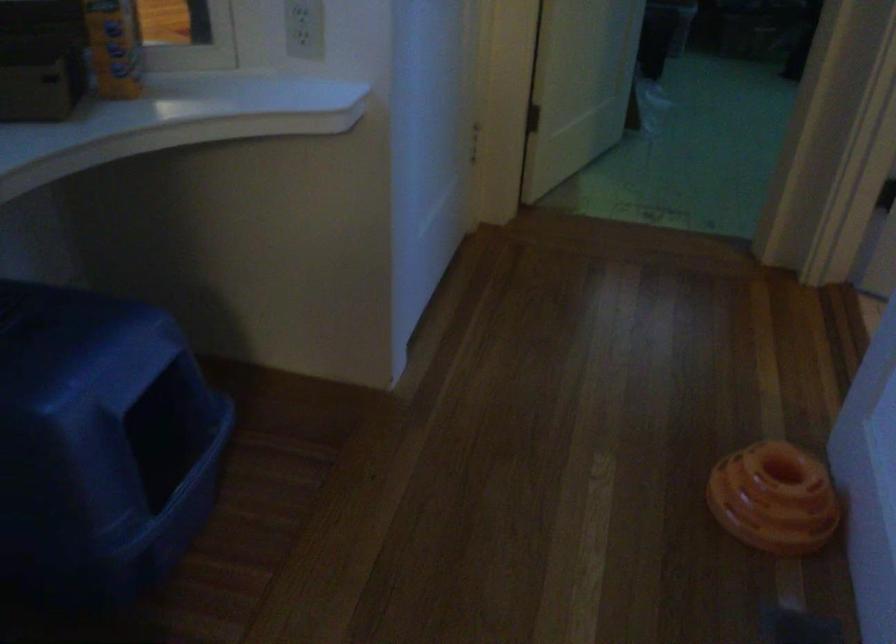
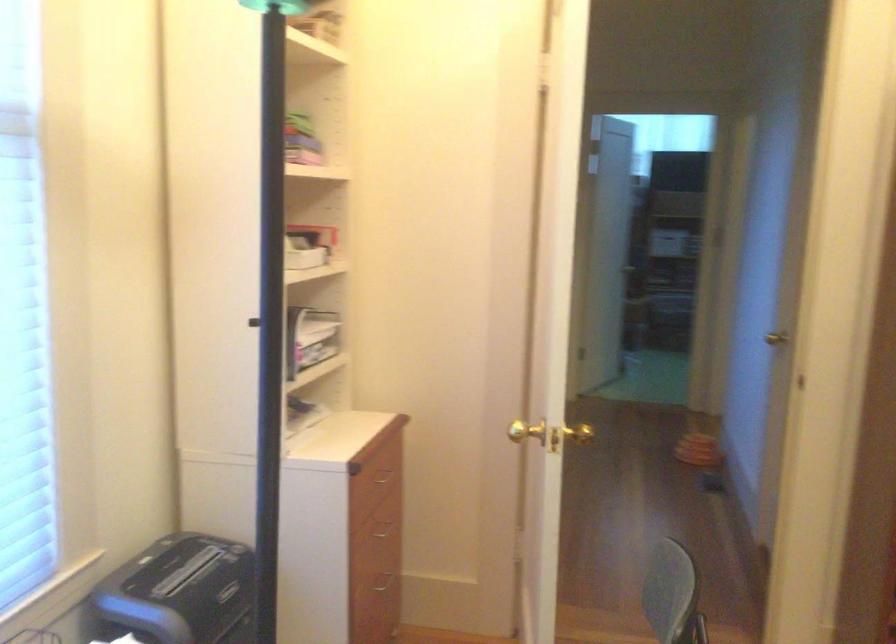
Question: I am providing you with two images of the same scene from different viewpoints. Which of the following objects are not visible in image2?

Choices:
 (A) yellow can
 (B) white disposable cup
 (C) gold door knob
 (D) drawer handle

Answer: (A)